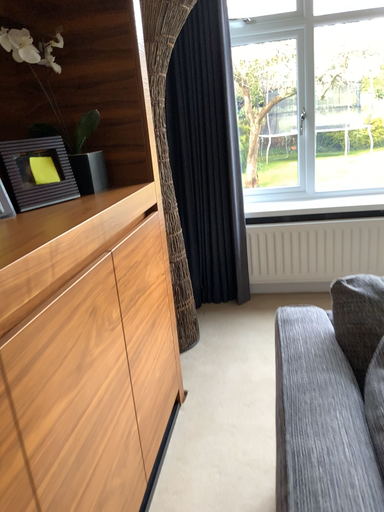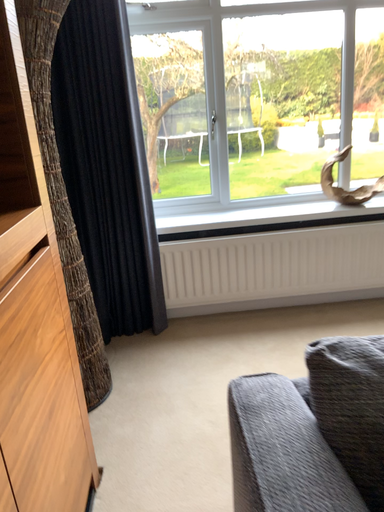
Question: How did the camera likely rotate when shooting the video?

Choices:
 (A) rotated right
 (B) rotated left

Answer: (A)